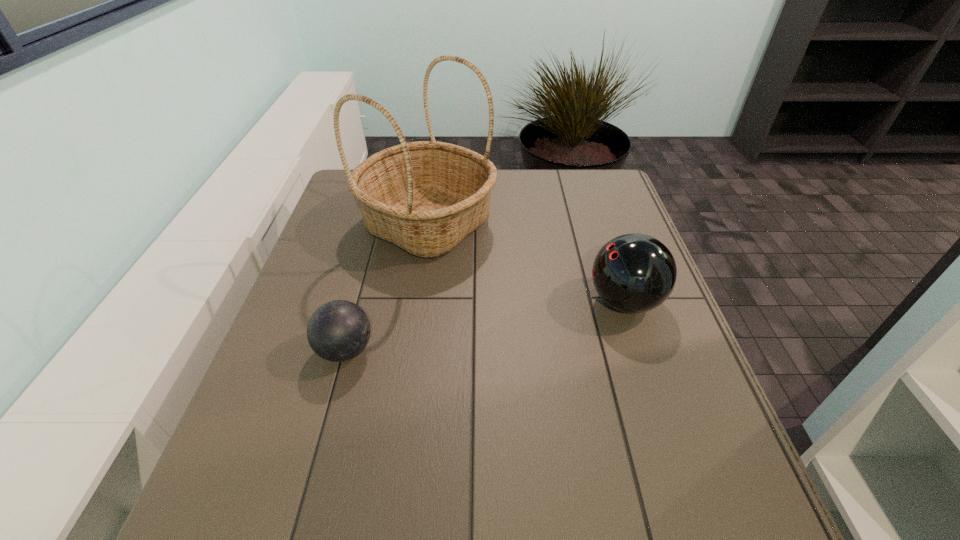
The height and width of the screenshot is (540, 960). I want to click on free location located on the grip area of the left bowling ball, so click(530, 350).

Where is `object present at the far edge`? The height and width of the screenshot is (540, 960). object present at the far edge is located at coordinates (425, 197).

This screenshot has height=540, width=960. In order to click on basket that is at the left edge in this screenshot , I will do `click(425, 197)`.

This screenshot has width=960, height=540. I want to click on bowling ball that is at the left edge, so click(339, 330).

Where is `object at the right edge`? Image resolution: width=960 pixels, height=540 pixels. object at the right edge is located at coordinates (634, 273).

Where is `object present at the far left corner`? object present at the far left corner is located at coordinates (425, 197).

Locate an element on the screen. Image resolution: width=960 pixels, height=540 pixels. vacant region at the far edge of the desktop is located at coordinates (504, 170).

In the image, there is a desktop. Identify the location of free space at the near edge. The width and height of the screenshot is (960, 540). (490, 516).

This screenshot has width=960, height=540. In the image, there is a desktop. What are the coordinates of `vacant space at the left edge` in the screenshot? It's located at (347, 218).

The height and width of the screenshot is (540, 960). Identify the location of free space at the far right corner of the desktop. (591, 189).